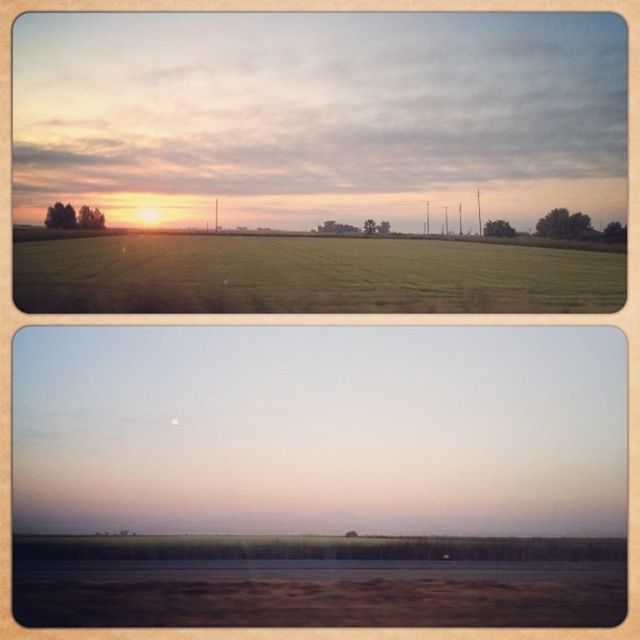
You are a passenger sitting in a train car with a transparent glass train window at center and a green matte tree at center visible outside. Which object is closer to you?

The transparent glass train window at center is closer to you since it is located below the green matte tree at center, placing it between you and the tree.

You are inside a train carriage and looking out the transparent glass train window at center. What do you see outside the window?

You can see the serene rural landscape with a gradient sky transitioning from warm orange to cool blue, lush green grass field, and the sun low on the horizon.

Looking at the top frame of the image, which contains a rural landscape with two types of trees, the green matte trees at left and the green leafy tree at right, can you determine which group of trees has a greater width?

The green matte trees at left have a greater width than the green leafy tree at right.